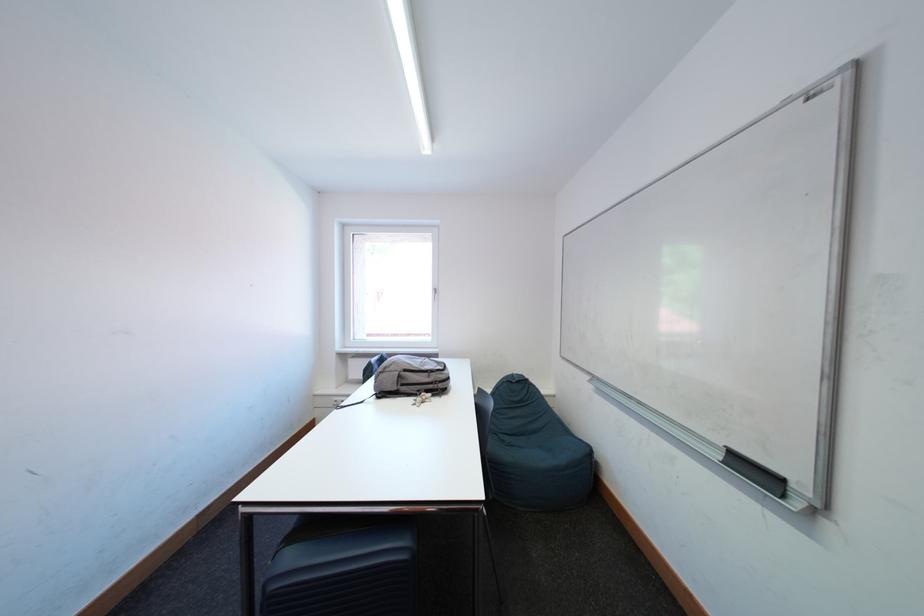
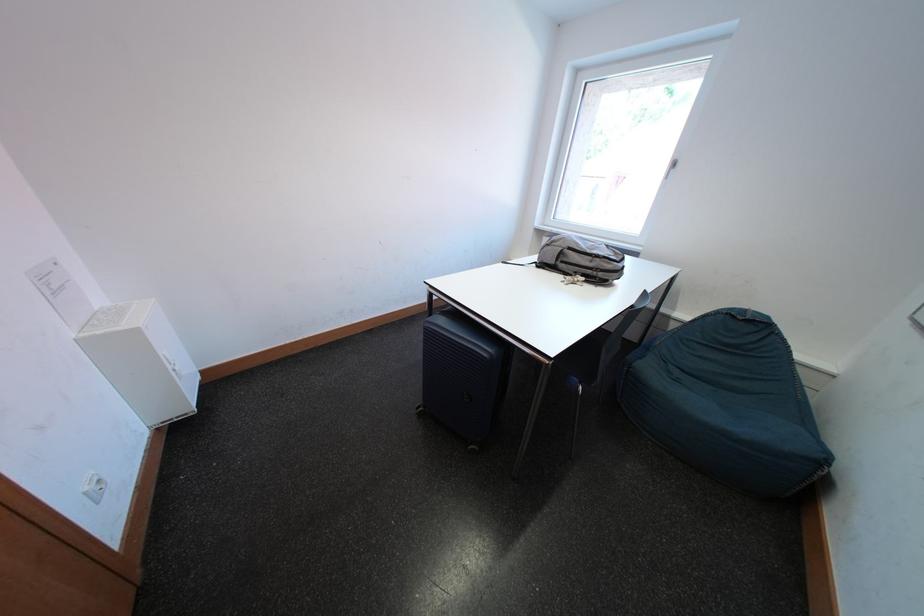
In the second image, find the point that corresponds to point 438,379 in the first image.

(601, 265)